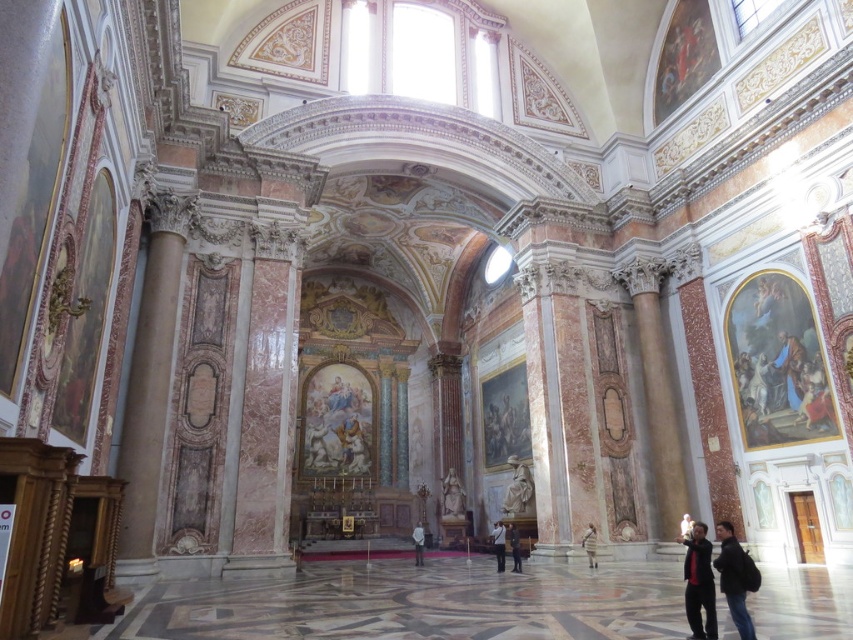
You are visiting the church and notice a matte white statue at center and a light brown leather jacket at center. Which object is positioned higher in the scene?

The light brown leather jacket at center is positioned higher than the matte white statue at center since the statue is located below the jacket.

You are a visitor standing at the entrance of the church. You see a matte white statue at center and a light brown leather jacket at center. Which object is positioned to the left from your perspective?

The matte white statue at center is to the left of the light brown leather jacket at center from the visitor perspective.